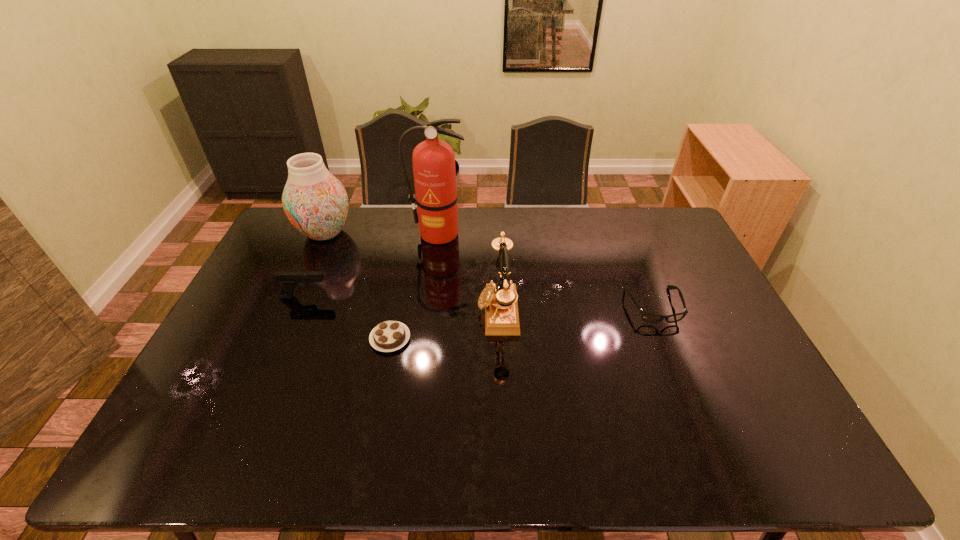
The width and height of the screenshot is (960, 540). Identify the location of blank space that satisfies the following two spatial constraints: 1. on the front-facing side of the chocolate cake; 2. on the right side of the fourth tallest object. click(x=287, y=339).

The height and width of the screenshot is (540, 960). Identify the location of free space that satisfies the following two spatial constraints: 1. on the front-facing side of the spectacles; 2. on the dial of the fourth shortest object. (656, 310).